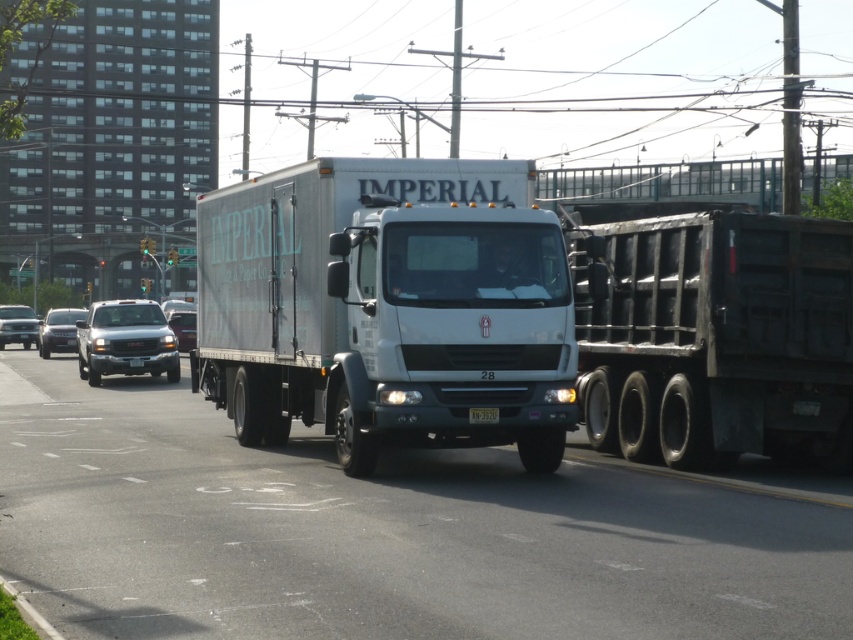
Is point (48, 314) positioned behind point (194, 333)?

Yes, point (48, 314) is behind point (194, 333).

Which is in front, point (73, 330) or point (192, 332)?

Point (192, 332) is more forward.

Where is `silver metallic sedan at left`? This screenshot has width=853, height=640. silver metallic sedan at left is located at coordinates (59, 330).

Between white glossy truck at center and black metal trailer truck at right, which one is positioned higher?

black metal trailer truck at right

How distant is white glossy truck at center from black metal trailer truck at right?

A distance of 2.31 meters exists between white glossy truck at center and black metal trailer truck at right.

Is point (635, 515) farther from viewer compared to point (753, 275)?

No, (635, 515) is closer to viewer.

Where is `white glossy truck at center`? Image resolution: width=853 pixels, height=640 pixels. white glossy truck at center is located at coordinates (386, 532).

Does black metal trailer truck at right have a larger size compared to black plastic license plate at center?

Yes.

Is black metal trailer truck at right smaller than black plastic license plate at center?

No.

Between point (672, 321) and point (480, 413), which one is positioned behind?

Point (672, 321)

At what (x,y) coordinates should I click in order to perform the action: click on black metal trailer truck at right. Please return your answer as a coordinate pair (x, y). The width and height of the screenshot is (853, 640). Looking at the image, I should click on (714, 333).